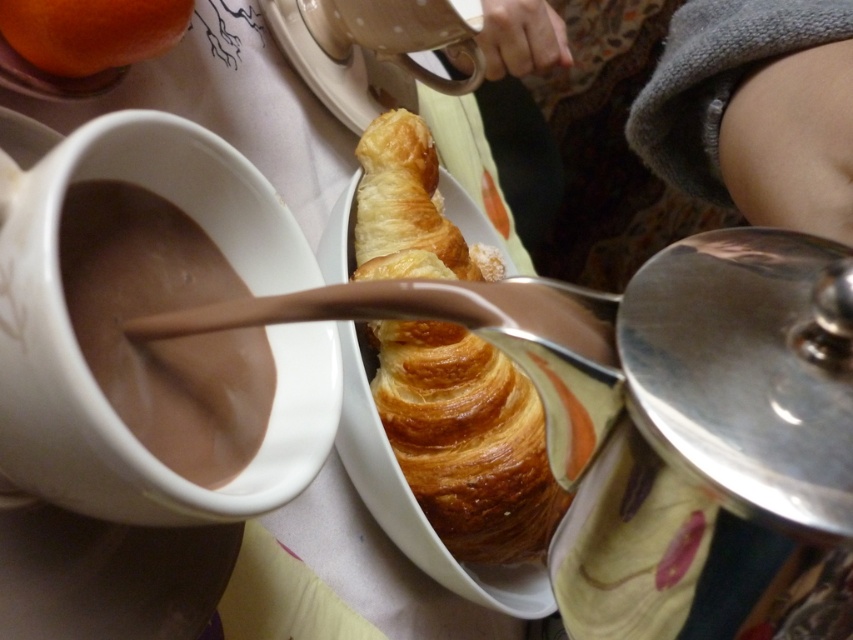
Question: Among these objects, which one is nearest to the camera?

Choices:
 (A) golden brown flaky croissant at center
 (B) orange matte at upper left

Answer: (A)

Question: Is golden brown flaky croissant at center to the left of smooth chocolate at left from the viewer's perspective?

Choices:
 (A) yes
 (B) no

Answer: (B)

Question: Among these points, which one is nearest to the camera?

Choices:
 (A) (107, 35)
 (B) (82, 332)

Answer: (B)

Question: Among these points, which one is nearest to the camera?

Choices:
 (A) (155, 384)
 (B) (93, 17)
 (C) (456, 404)

Answer: (A)

Question: Does smooth chocolate at left lie in front of orange matte at upper left?

Choices:
 (A) no
 (B) yes

Answer: (B)

Question: Is smooth chocolate at left below orange matte at upper left?

Choices:
 (A) yes
 (B) no

Answer: (A)